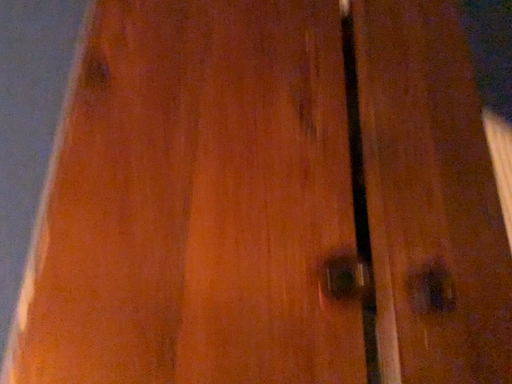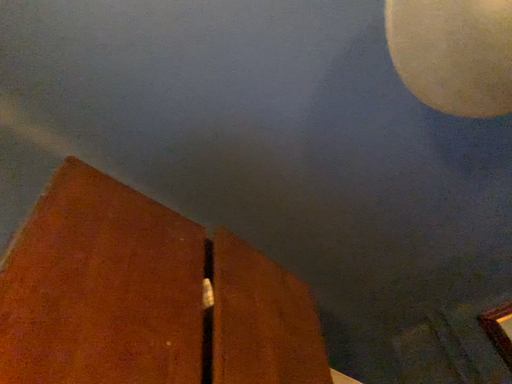
Question: Which way did the camera rotate in the video?

Choices:
 (A) rotated right
 (B) rotated left

Answer: (A)